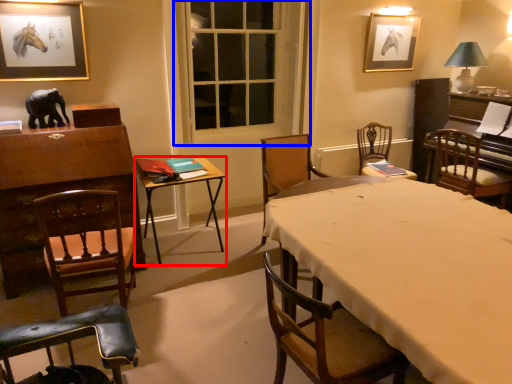
Question: Among these objects, which one is farthest to the camera, table (highlighted by a red box) or window screen (highlighted by a blue box)?

Choices:
 (A) table
 (B) window screen

Answer: (B)